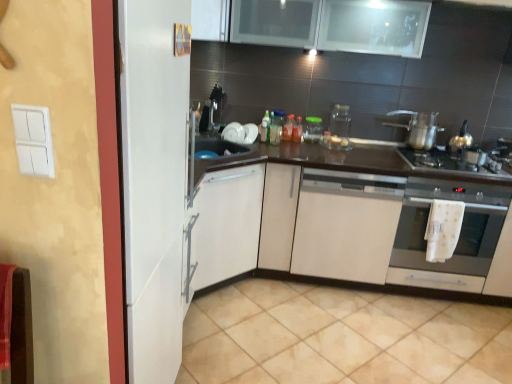
Question: Is translucent plastic bottle at center, the 1th bottle viewed from the right, smaller than translucent glass jar at center, which is counted as the third bottle, starting from the right?

Choices:
 (A) no
 (B) yes

Answer: (B)

Question: Can you confirm if translucent plastic bottle at center, the 1th bottle viewed from the right, is shorter than translucent glass jar at center, the 2th bottle when ordered from left to right?

Choices:
 (A) no
 (B) yes

Answer: (B)

Question: Can you confirm if translucent plastic bottle at center, the 1th bottle viewed from the right, is wider than translucent glass jar at center, the 2th bottle when ordered from left to right?

Choices:
 (A) yes
 (B) no

Answer: (B)

Question: Are translucent plastic bottle at center, the 1th bottle viewed from the right, and translucent glass jar at center, the 2th bottle when ordered from left to right, beside each other?

Choices:
 (A) yes
 (B) no

Answer: (B)

Question: Can you confirm if translucent plastic bottle at center, the fourth bottle positioned from the left, is bigger than translucent glass jar at center, which is counted as the third bottle, starting from the right?

Choices:
 (A) yes
 (B) no

Answer: (B)

Question: Considering the positions of metallic silver gas stove at right and translucent glass jar at center, the 2th bottle when ordered from left to right, in the image, is metallic silver gas stove at right bigger or smaller than translucent glass jar at center, the 2th bottle when ordered from left to right,?

Choices:
 (A) small
 (B) big

Answer: (B)

Question: In terms of height, does metallic silver gas stove at right look taller or shorter compared to translucent glass jar at center, the 2th bottle when ordered from left to right?

Choices:
 (A) tall
 (B) short

Answer: (B)

Question: From a real-world perspective, is metallic silver gas stove at right physically located above or below translucent glass jar at center, which is counted as the third bottle, starting from the right?

Choices:
 (A) below
 (B) above

Answer: (A)

Question: Considering the positions of point (412, 162) and point (282, 114), is point (412, 162) closer or farther from the camera than point (282, 114)?

Choices:
 (A) closer
 (B) farther

Answer: (A)

Question: Based on their sizes in the image, would you say satin silver oven at lower right is bigger or smaller than dark wood countertop at center?

Choices:
 (A) small
 (B) big

Answer: (A)

Question: From a real-world perspective, is satin silver oven at lower right physically located above or below dark wood countertop at center?

Choices:
 (A) below
 (B) above

Answer: (B)

Question: Is point (449, 284) positioned closer to the camera than point (309, 236)?

Choices:
 (A) farther
 (B) closer

Answer: (A)

Question: Is satin silver oven at lower right inside the boundaries of dark wood countertop at center, or outside?

Choices:
 (A) outside
 (B) inside

Answer: (B)

Question: From a real-world perspective, relative to white glossy plate at upper center, which is counted as the 3th appliance, starting from the right, is white matte cabinet at center vertically above or below?

Choices:
 (A) below
 (B) above

Answer: (A)

Question: Looking at their shapes, would you say white matte cabinet at center is wider or thinner than white glossy plate at upper center, the 1th appliance in the left-to-right sequence?

Choices:
 (A) wide
 (B) thin

Answer: (A)